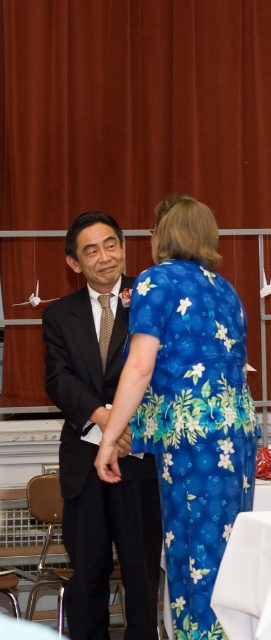
Question: Does blue floral fabric dress at center appear over matte black suit at center?

Choices:
 (A) yes
 (B) no

Answer: (A)

Question: Is blue floral fabric dress at center further to the viewer compared to matte black suit at center?

Choices:
 (A) yes
 (B) no

Answer: (B)

Question: Among these points, which one is farthest from the camera?

Choices:
 (A) (231, 620)
 (B) (139, 116)
 (C) (128, 284)
 (D) (198, 337)

Answer: (B)

Question: Which of the following is the closest to the observer?

Choices:
 (A) (79, 371)
 (B) (224, 285)
 (C) (259, 339)

Answer: (B)

Question: Considering the relative positions of blue floral fabric dress at center and white fabric tablecloth at lower center in the image provided, where is blue floral fabric dress at center located with respect to white fabric tablecloth at lower center?

Choices:
 (A) left
 (B) right

Answer: (A)

Question: Which point appears closest to the camera in this image?

Choices:
 (A) (250, 588)
 (B) (198, 348)

Answer: (A)